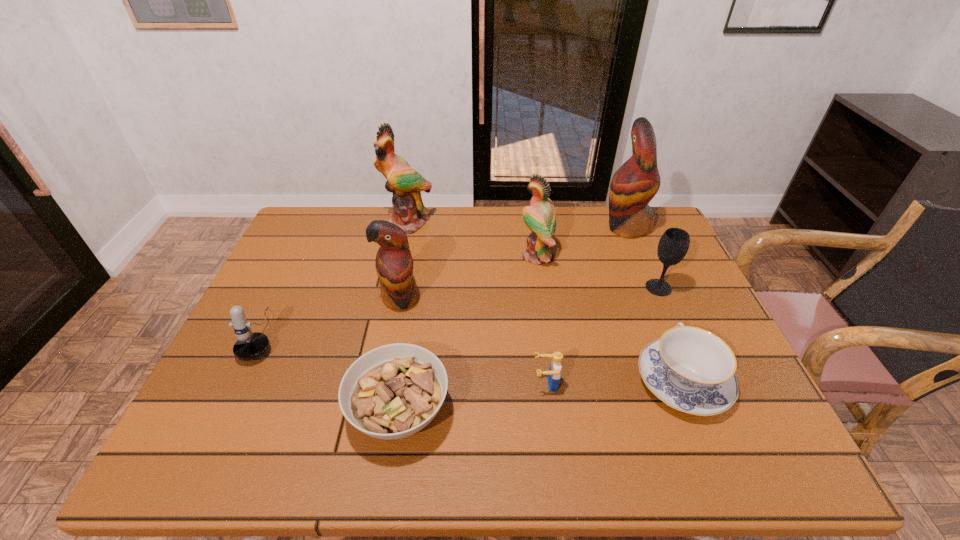
Locate an element on the screen. the rightmost parrot is located at coordinates (636, 182).

Locate an element on the screen. This screenshot has width=960, height=540. the right red parrot is located at coordinates (636, 182).

At what (x,y) coordinates should I click in order to perform the action: click on the farther green parrot. Please return your answer as a coordinate pair (x, y). The height and width of the screenshot is (540, 960). Looking at the image, I should click on (405, 183).

I want to click on the left green parrot, so click(x=405, y=183).

Identify the location of the third parrot from left to right. (540, 217).

Find the location of a particular element. This screenshot has height=540, width=960. the third farthest parrot is located at coordinates (540, 217).

The height and width of the screenshot is (540, 960). What are the coordinates of `the smaller red parrot` in the screenshot? It's located at (394, 264).

This screenshot has height=540, width=960. What are the coordinates of `the nearer red parrot` in the screenshot? It's located at (394, 264).

Where is `wineglass`? The height and width of the screenshot is (540, 960). wineglass is located at coordinates (673, 245).

Where is `the leftmost object`? the leftmost object is located at coordinates (249, 346).